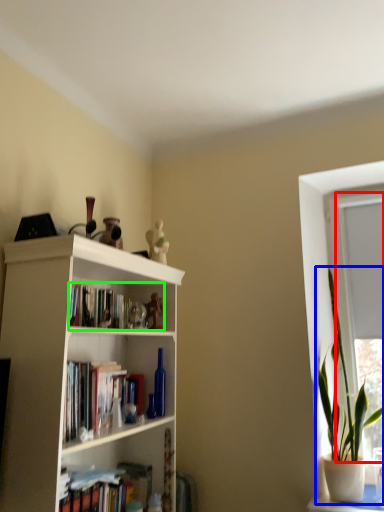
Question: Which object is the closest to the window frame (highlighted by a red box)? Choose among these: houseplant (highlighted by a blue box) or book (highlighted by a green box).

Choices:
 (A) houseplant
 (B) book

Answer: (A)